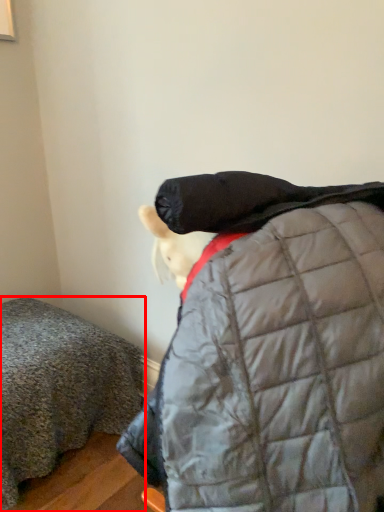
Question: Observing the image, what is the correct spatial positioning of furniture (annotated by the red box) in reference to jacket?

Choices:
 (A) right
 (B) left

Answer: (B)